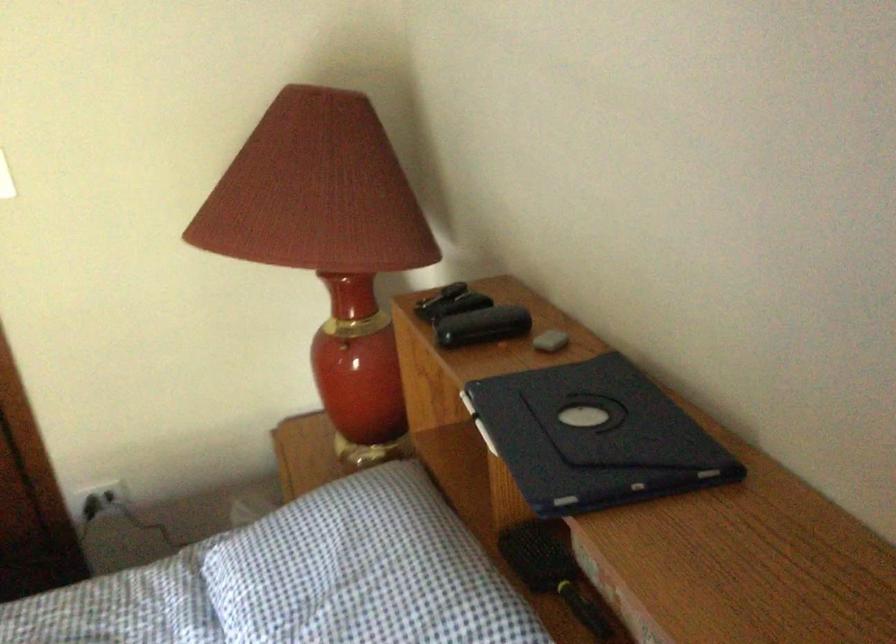
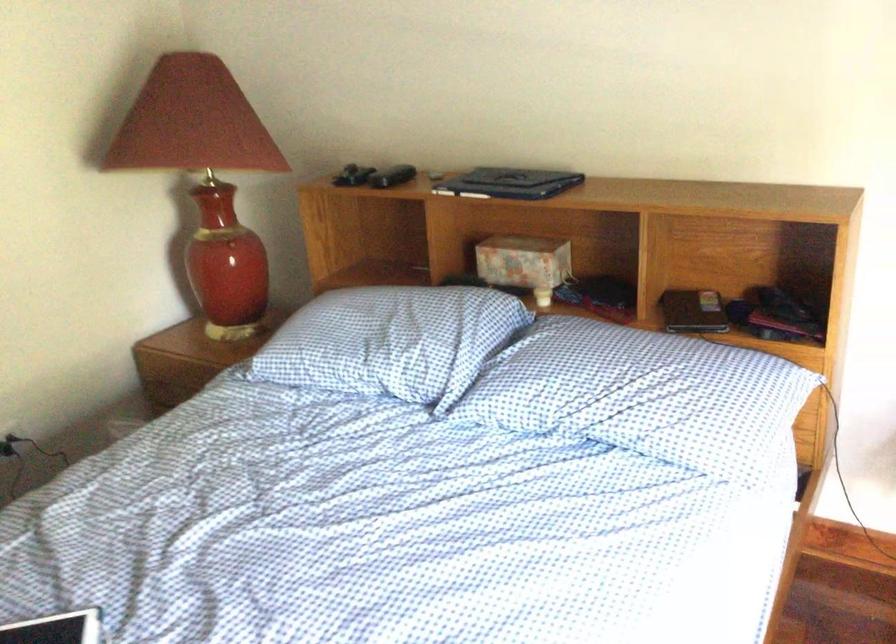
Locate, in the second image, the point that corresponds to point 340,361 in the first image.

(229, 249)